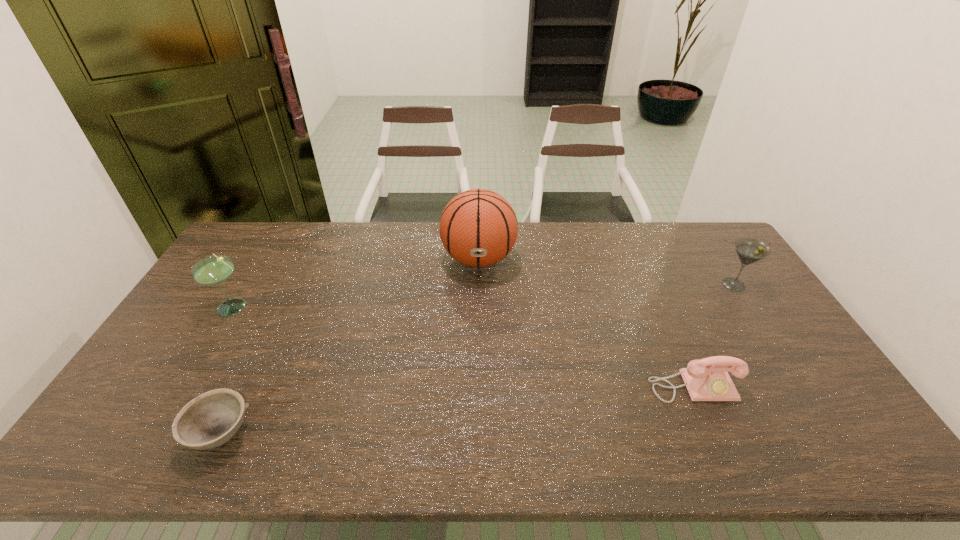
At what (x,y) coordinates should I click in order to perform the action: click on vacant space at the right edge. Please return your answer as a coordinate pair (x, y). This screenshot has height=540, width=960. Looking at the image, I should click on (741, 279).

The height and width of the screenshot is (540, 960). Identify the location of vacant space at the far right corner of the desktop. (705, 226).

This screenshot has width=960, height=540. In the image, there is a desktop. What are the coordinates of `vacant area at the near right corner` in the screenshot? It's located at (825, 431).

You are a GUI agent. You are given a task and a screenshot of the screen. Output one action in this format:
    pyautogui.click(x=<x>, y=<y>)
    Task: Click on the vacant area that lies between the left martini and the rightmost object
    The height and width of the screenshot is (540, 960).
    Given the screenshot: What is the action you would take?
    pyautogui.click(x=485, y=295)

This screenshot has height=540, width=960. I want to click on vacant space in between the shortest object and the fourth farthest object, so click(x=457, y=410).

Locate an element on the screen. free space between the basketball and the shortest object is located at coordinates 349,346.

The height and width of the screenshot is (540, 960). Find the location of `vacant region between the second object from right to left and the right martini`. vacant region between the second object from right to left and the right martini is located at coordinates (713, 336).

I want to click on vacant area between the rightmost object and the second object from left to right, so click(x=477, y=359).

Locate an element on the screen. Image resolution: width=960 pixels, height=540 pixels. free space between the basketball and the rightmost object is located at coordinates (607, 272).

This screenshot has width=960, height=540. Find the location of `vacant area between the telephone and the right martini`. vacant area between the telephone and the right martini is located at coordinates (713, 336).